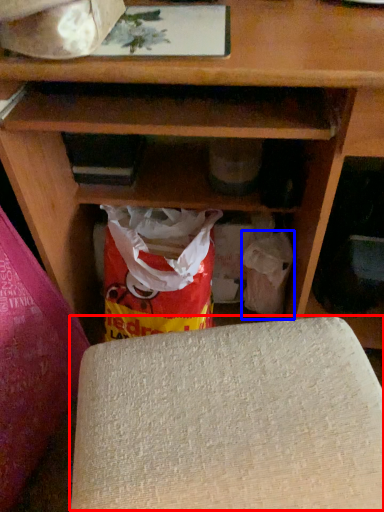
Question: Which of the following is the closest to the observer, yoga mat (highlighted by a red box) or grocery bag (highlighted by a blue box)?

Choices:
 (A) yoga mat
 (B) grocery bag

Answer: (A)